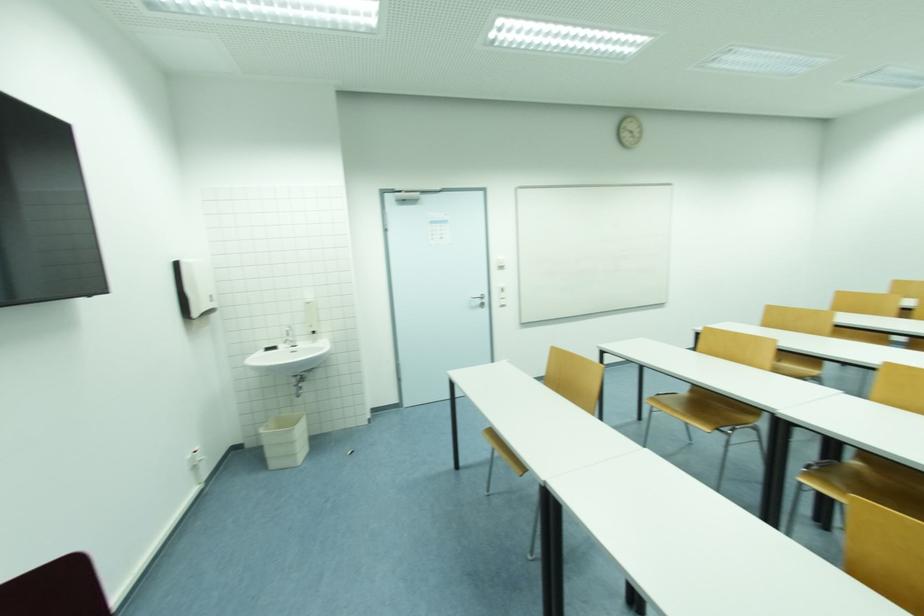
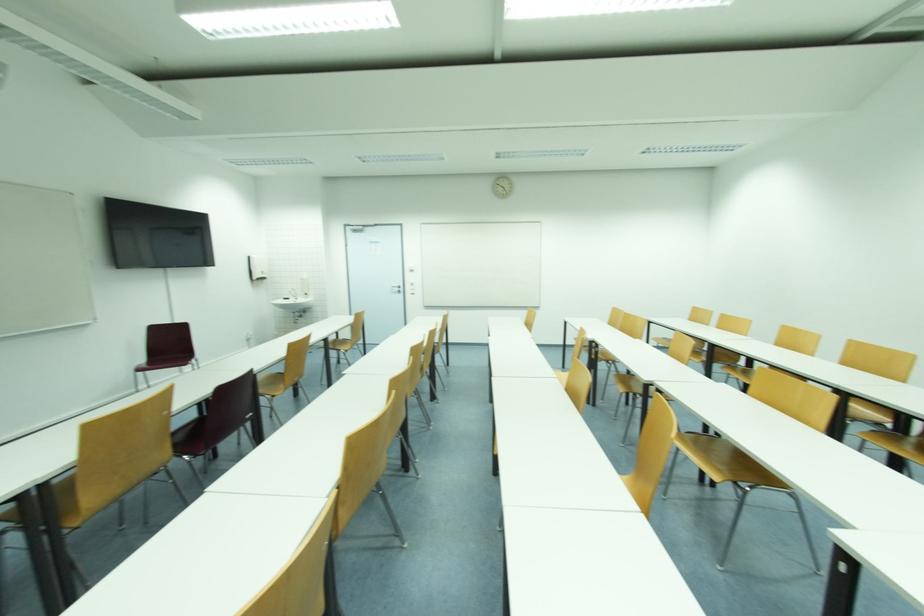
What movement of the cameraman would produce the second image?

The cameraman moved toward right, backward.